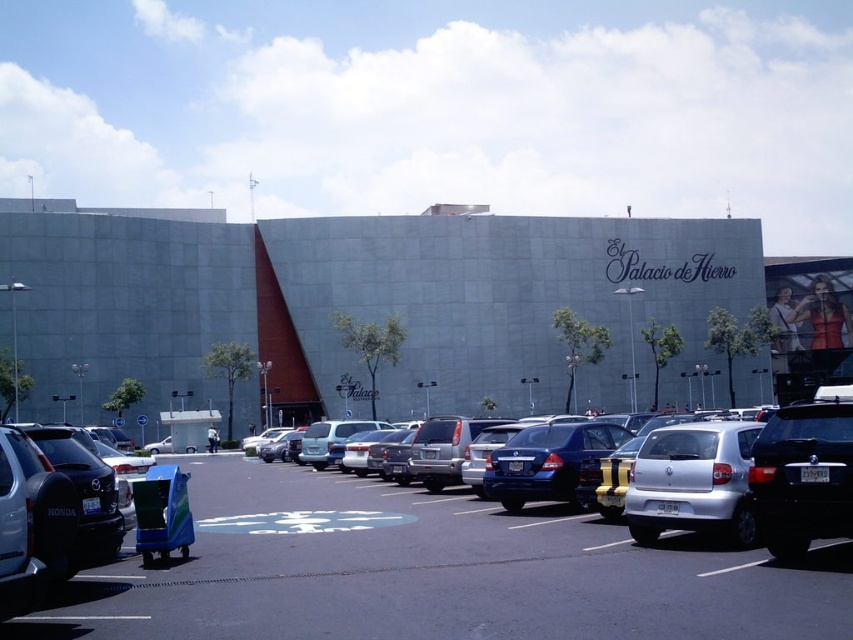
You are standing in the parking lot and want to walk towards the building. Which direction should you move to get closer to the gray concrete building at center while avoiding the smooth asphalt parking lot at center?

You should move towards the gray concrete building at center since it is closer to you than the smooth asphalt parking lot at center. However, since both are at the center, you might need to adjust your path slightly to the side to avoid the parking lot area.

You are standing at point A which is at the coordinates of point (38, 276) and want to walk to point B at (764, 604). Since you can only move forward, will you be able to see point B from your current position?

Point (38, 276) is behind point (764, 604), so you cannot see point B from your current position at point A because it is obstructed by the building or other objects between them.

You are a delivery driver who needs to park your truck in the parking lot. Your truck is 10 meters long. The parking lot has a gray concrete building at center and a silver metallic sedan at center. Can you park your truck between them without overlapping either vehicle?

The gray concrete building at center and silver metallic sedan at center are 44.62 meters apart. Since your truck is only 10 meters long, there is sufficient space between them to park without overlapping either vehicle.